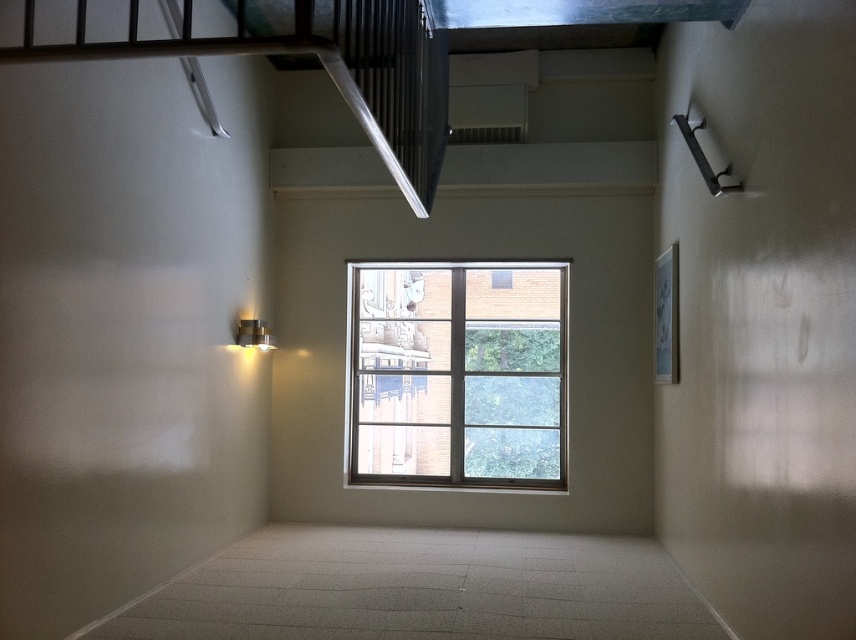
You are standing in the room and want to walk from point (373,266) to point (440,54). Which direction should you move to get closer to your destination?

You should move towards the direction away from the window because point (373,266) is closer to you than point (440,54), so moving away from the window will bring you closer to the destination.

You are standing in the room and want to know which object is taller between the clear glass window at center and the metallic silver stairwell at upper left. Based on the scene description, can you determine which one is taller?

The clear glass window at center is taller than the metallic silver stairwell at upper left according to the description.